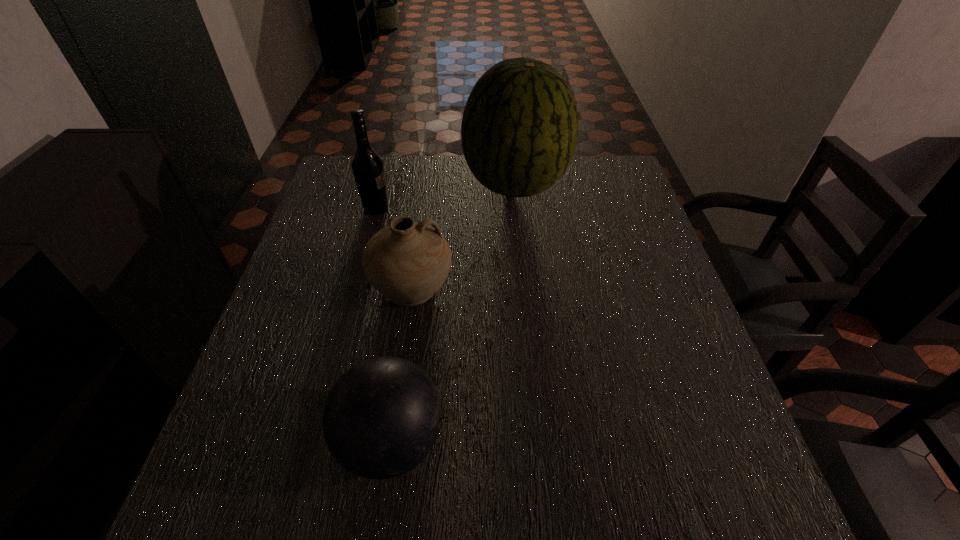
In order to click on wine bottle present at the far edge in this screenshot , I will do `click(368, 169)`.

At what (x,y) coordinates should I click in order to perform the action: click on object located at the near edge. Please return your answer as a coordinate pair (x, y). This screenshot has width=960, height=540. Looking at the image, I should click on (381, 418).

The width and height of the screenshot is (960, 540). In order to click on object that is positioned at the left edge in this screenshot , I will do `click(368, 169)`.

At what (x,y) coordinates should I click in order to perform the action: click on object located at the far left corner. Please return your answer as a coordinate pair (x, y). Looking at the image, I should click on coord(368,169).

Locate an element on the screen. Image resolution: width=960 pixels, height=540 pixels. vacant space at the far edge of the desktop is located at coordinates (458, 161).

Find the location of a particular element. The width and height of the screenshot is (960, 540). vacant space at the left edge of the desktop is located at coordinates (324, 284).

In the image, there is a desktop. At what (x,y) coordinates should I click in order to perform the action: click on blank space at the right edge. Please return your answer as a coordinate pair (x, y). Image resolution: width=960 pixels, height=540 pixels. Looking at the image, I should click on (618, 327).

The width and height of the screenshot is (960, 540). In order to click on free point at the far left corner in this screenshot , I will do `click(335, 179)`.

At what (x,y) coordinates should I click in order to perform the action: click on vacant space at the near left corner. Please return your answer as a coordinate pair (x, y). The image size is (960, 540). Looking at the image, I should click on (286, 506).

Locate an element on the screen. blank area at the far right corner is located at coordinates (614, 162).